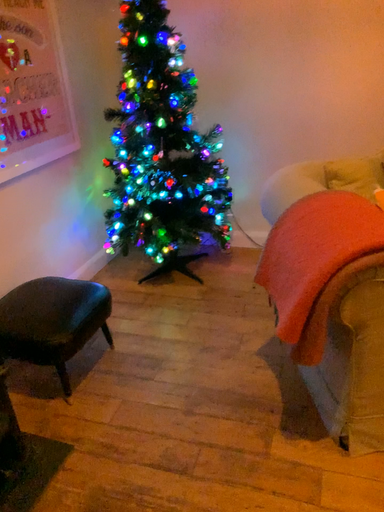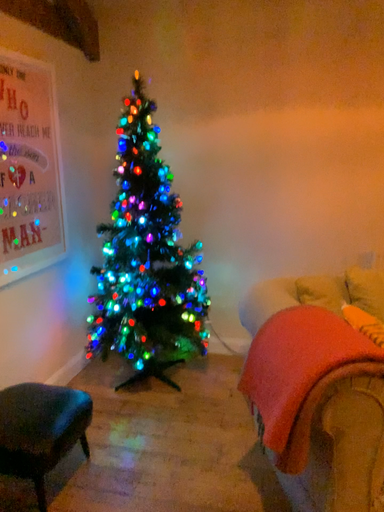
Question: Which way did the camera rotate in the video?

Choices:
 (A) rotated downward
 (B) rotated upward

Answer: (B)